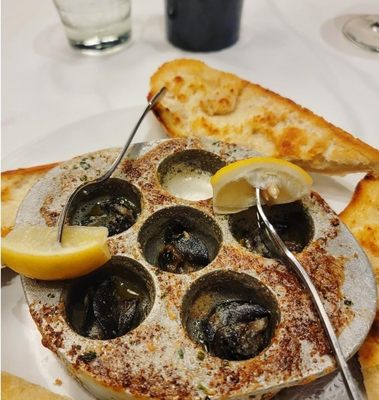
Locate an element on the screen. Image resolution: width=379 pixels, height=400 pixels. forks is located at coordinates (274, 233), (71, 197).